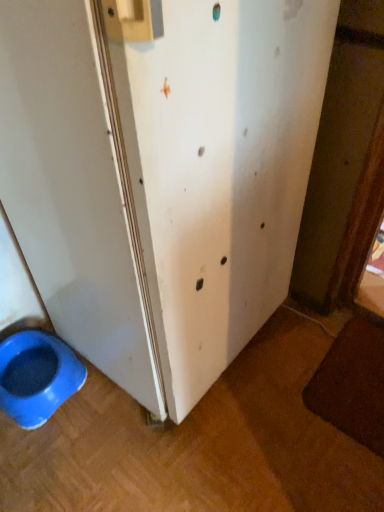
Question: Considering the positions of white matte screen door at lower left and blue plastic bowl at lower left in the image, is white matte screen door at lower left taller or shorter than blue plastic bowl at lower left?

Choices:
 (A) tall
 (B) short

Answer: (A)

Question: Is white matte screen door at lower left inside the boundaries of blue plastic bowl at lower left, or outside?

Choices:
 (A) outside
 (B) inside

Answer: (A)

Question: In terms of width, does white matte screen door at lower left look wider or thinner when compared to blue plastic bowl at lower left?

Choices:
 (A) wide
 (B) thin

Answer: (A)

Question: Is point (51, 412) closer or farther from the camera than point (218, 373)?

Choices:
 (A) farther
 (B) closer

Answer: (B)

Question: In the image, is blue plastic bowl at lower left positioned in front of or behind white matte screen door at lower left?

Choices:
 (A) behind
 (B) front

Answer: (A)

Question: From the image's perspective, is blue plastic bowl at lower left located above or below white matte screen door at lower left?

Choices:
 (A) below
 (B) above

Answer: (A)

Question: From a real-world perspective, is blue plastic bowl at lower left positioned above or below white matte screen door at lower left?

Choices:
 (A) below
 (B) above

Answer: (A)